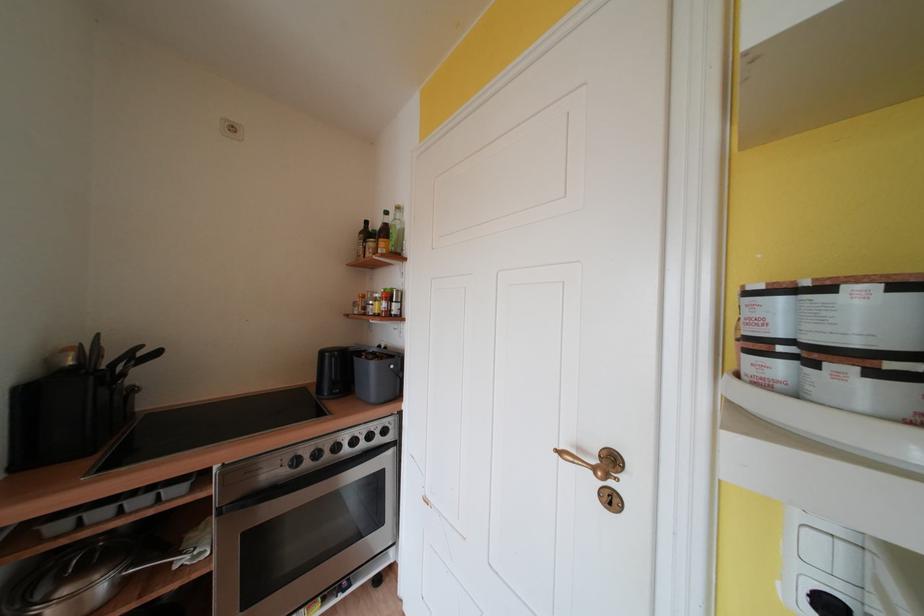
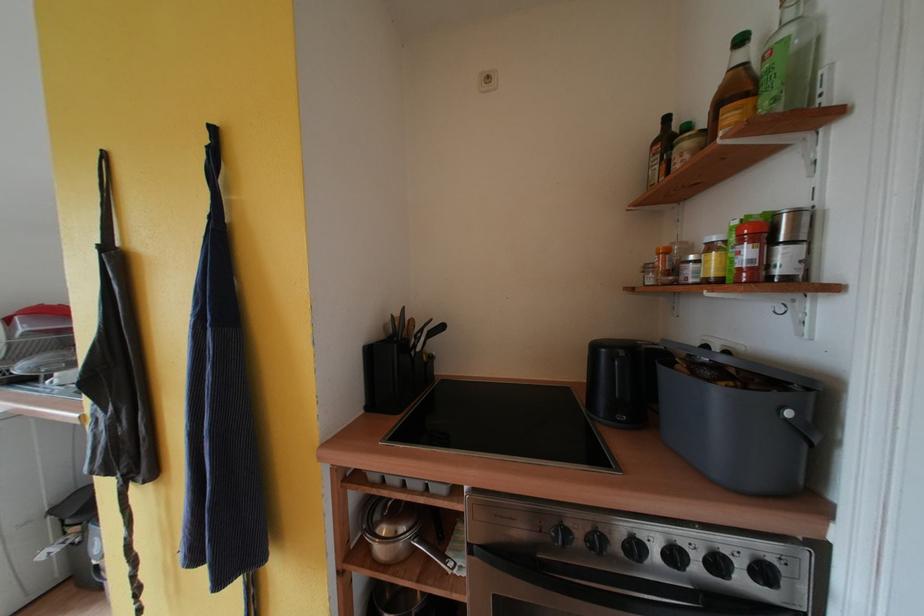
The point at (360, 446) is marked in the first image. Where is the corresponding point in the second image?

(681, 560)